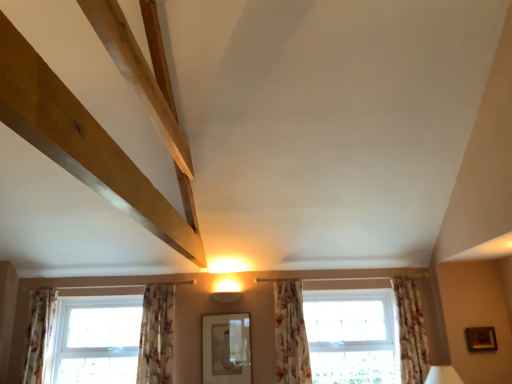
Question: Should I look upward or downward to see clear glass window at lower left, the first window from the left?

Choices:
 (A) down
 (B) up

Answer: (A)

Question: Is the position of floral fabric curtain at center, which is the third curtain from left to right, more distant than that of floral fabric curtain at right, the first curtain positioned from the right?

Choices:
 (A) no
 (B) yes

Answer: (A)

Question: From the image's perspective, is floral fabric curtain at center, which is the third curtain from left to right, over floral fabric curtain at right, the first curtain positioned from the right?

Choices:
 (A) yes
 (B) no

Answer: (B)

Question: Is floral fabric curtain at center, which is the third curtain from left to right, wider than floral fabric curtain at right, the fourth curtain positioned from the left?

Choices:
 (A) yes
 (B) no

Answer: (B)

Question: Considering the relative sizes of floral fabric curtain at center, positioned as the 2th curtain in right-to-left order, and floral fabric curtain at right, the first curtain positioned from the right, in the image provided, is floral fabric curtain at center, positioned as the 2th curtain in right-to-left order, taller than floral fabric curtain at right, the first curtain positioned from the right,?

Choices:
 (A) no
 (B) yes

Answer: (A)

Question: Is floral fabric curtain at center, which is the third curtain from left to right, at the left side of floral fabric curtain at right, the fourth curtain positioned from the left?

Choices:
 (A) no
 (B) yes

Answer: (B)

Question: Is floral fabric curtain at right, the fourth curtain positioned from the left, inside floral fabric curtain at center, which is the third curtain from left to right?

Choices:
 (A) no
 (B) yes

Answer: (A)

Question: Considering the relative positions of floral fabric curtain at center, which is the third curtain from left to right, and natural wood beam at upper left in the image provided, is floral fabric curtain at center, which is the third curtain from left to right, to the left of natural wood beam at upper left from the viewer's perspective?

Choices:
 (A) yes
 (B) no

Answer: (B)

Question: Is floral fabric curtain at center, which is the third curtain from left to right, outside natural wood beam at upper left?

Choices:
 (A) yes
 (B) no

Answer: (A)

Question: Can you confirm if floral fabric curtain at center, positioned as the 2th curtain in right-to-left order, is smaller than natural wood beam at upper left?

Choices:
 (A) yes
 (B) no

Answer: (A)

Question: Does floral fabric curtain at center, positioned as the 2th curtain in right-to-left order, lie behind natural wood beam at upper left?

Choices:
 (A) yes
 (B) no

Answer: (A)

Question: Is floral fabric curtain at center, which is the third curtain from left to right, looking in the opposite direction of natural wood beam at upper left?

Choices:
 (A) no
 (B) yes

Answer: (A)

Question: From the image's perspective, is floral fabric curtain at center, positioned as the 2th curtain in right-to-left order, located beneath natural wood beam at upper left?

Choices:
 (A) no
 (B) yes

Answer: (B)